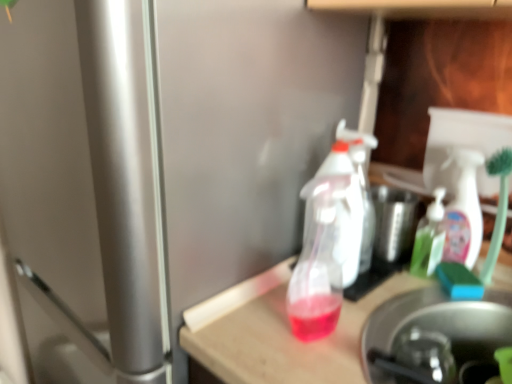
Locate an element on the screen. This screenshot has width=512, height=384. vacant area that lies to the right of translucent plastic spray bottle at center, the 1th bottle when ordered from left to right is located at coordinates (380, 314).